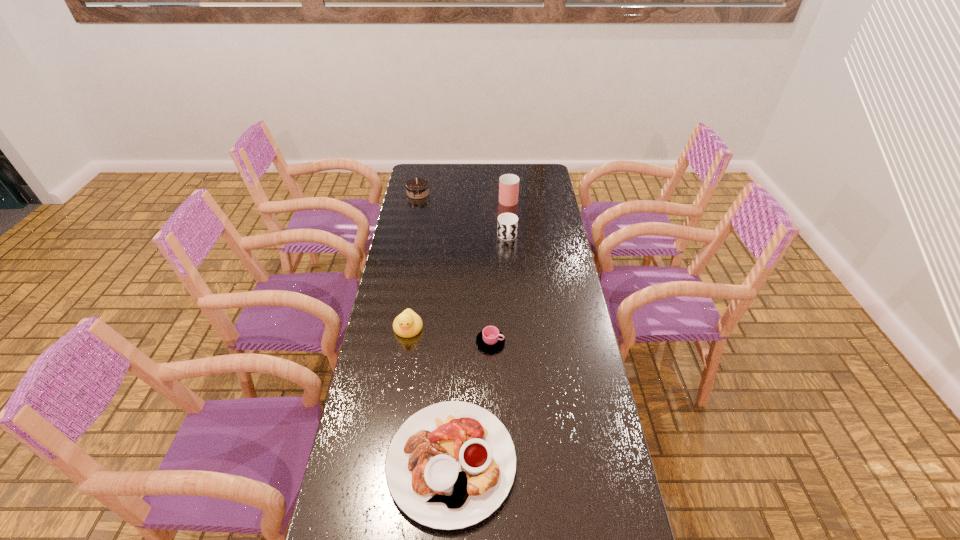
Find the location of a particular element. object at the far left corner is located at coordinates (417, 188).

Where is `vacant space at the far edge of the desktop`? The image size is (960, 540). vacant space at the far edge of the desktop is located at coordinates (457, 179).

I want to click on vacant space at the left edge, so click(x=412, y=396).

At what (x,y) coordinates should I click in order to perform the action: click on free space at the right edge of the desktop. Please return your answer as a coordinate pair (x, y). This screenshot has height=540, width=960. Looking at the image, I should click on (534, 206).

This screenshot has height=540, width=960. In order to click on free space between the duckling and the farthest cup in this screenshot , I will do `click(458, 264)`.

I want to click on free space between the platter and the chocolate cake, so click(435, 328).

The width and height of the screenshot is (960, 540). In order to click on empty space that is in between the tallest cup and the nearest object in this screenshot , I will do `click(480, 330)`.

At what (x,y) coordinates should I click in order to perform the action: click on vacant region between the chocolate cake and the nearest cup. Please return your answer as a coordinate pair (x, y). This screenshot has width=960, height=540. Looking at the image, I should click on (454, 267).

This screenshot has height=540, width=960. Identify the location of blank region between the duckling and the nearest cup. (449, 335).

Locate an element on the screen. Image resolution: width=960 pixels, height=540 pixels. empty location between the chocolate cake and the farthest cup is located at coordinates (463, 196).